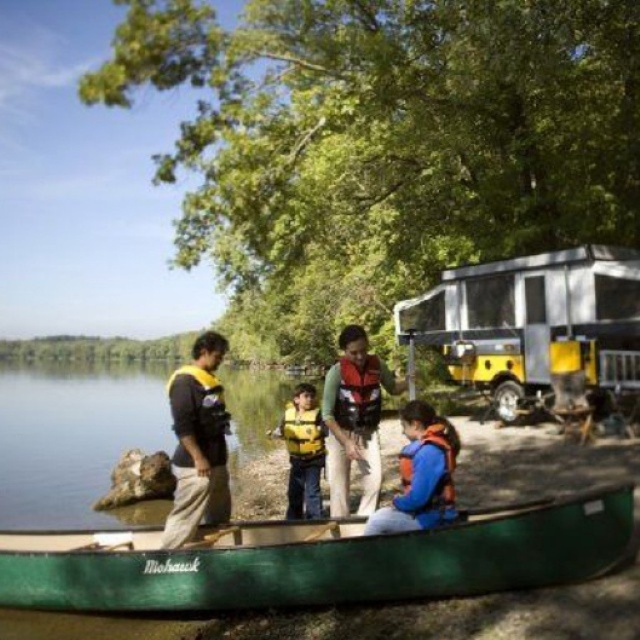
Question: Is yellow metallic camper at right to the left of yellow life vest at center from the viewer's perspective?

Choices:
 (A) no
 (B) yes

Answer: (A)

Question: Which object is farther from the camera taking this photo?

Choices:
 (A) clear blue water at center
 (B) green matte canoe at center
 (C) yellow metallic camper at right

Answer: (C)

Question: Estimate the real-world distances between objects in this image. Which object is farther from the yellow life vest at center?

Choices:
 (A) green matte canoe at center
 (B) blue fabric life vest at center

Answer: (B)

Question: Which point is closer to the camera?

Choices:
 (A) blue fabric life jacket at lower center
 (B) yellow matte life jacket at center
 (C) matte orange life vest at center
 (D) clear blue water at center

Answer: (A)

Question: Does clear blue water at center appear over red matte life jacket at center?

Choices:
 (A) no
 (B) yes

Answer: (A)

Question: Is green matte canoe at center bigger than yellow matte life jacket at center?

Choices:
 (A) yes
 (B) no

Answer: (B)